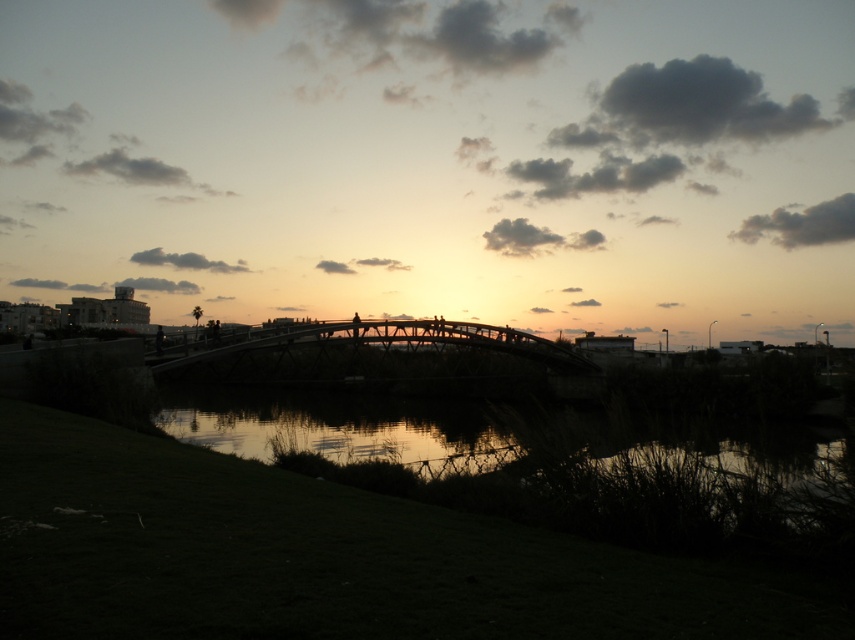
Question: Which point is closer to the camera?

Choices:
 (A) wooden bridge at center
 (B) silvery reflective water at center

Answer: (B)

Question: Is silvery reflective water at center smaller than wooden bridge at center?

Choices:
 (A) yes
 (B) no

Answer: (B)

Question: In this image, where is silvery reflective water at center located relative to wooden bridge at center?

Choices:
 (A) above
 (B) below

Answer: (B)

Question: Can you confirm if silvery reflective water at center is bigger than wooden bridge at center?

Choices:
 (A) no
 (B) yes

Answer: (B)